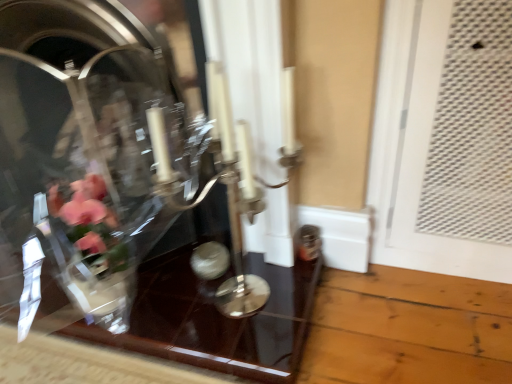
The width and height of the screenshot is (512, 384). What are the coordinates of `free spot below silver metallic candle holder at center (from a real-world perspective)` in the screenshot? It's located at (261, 289).